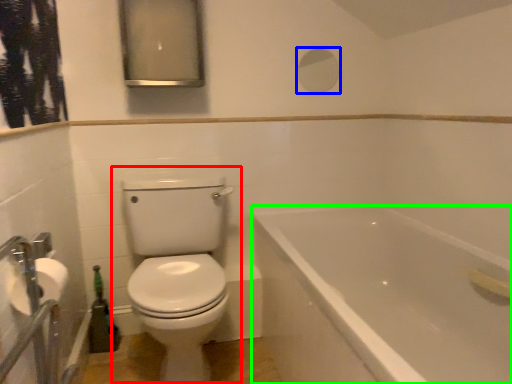
Question: Based on their relative distances, which object is farther from toilet (highlighted by a red box)? Choose from mirror (highlighted by a blue box) and bathtub (highlighted by a green box).

Choices:
 (A) mirror
 (B) bathtub

Answer: (A)